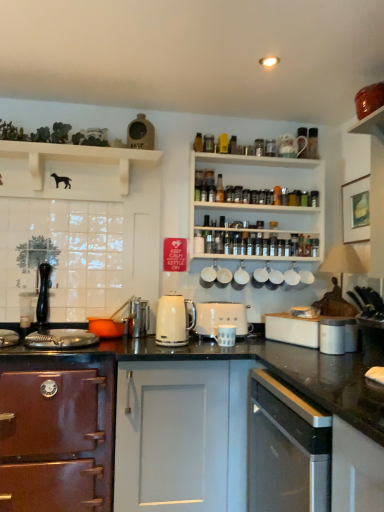
I want to click on free space to the left of white glossy mug at center, the sixth appliance in the right-to-left sequence, so click(203, 343).